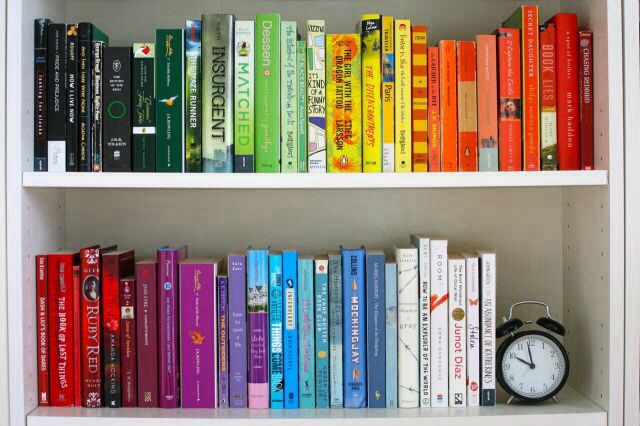
This screenshot has height=426, width=640. Find the location of `white books`. white books is located at coordinates (403, 347), (419, 331), (434, 343), (456, 351), (467, 345), (486, 349).